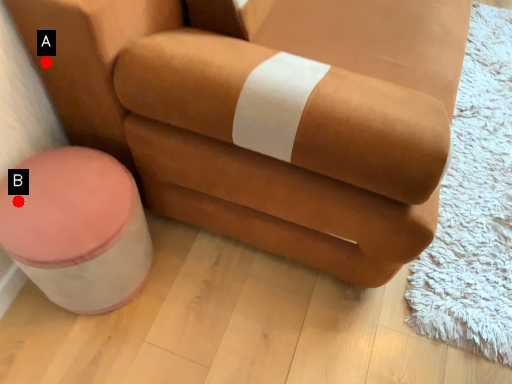
Question: Two points are circled on the image, labeled by A and B beside each circle. Which point is closer to the camera taking this photo?

Choices:
 (A) A is closer
 (B) B is closer

Answer: (B)